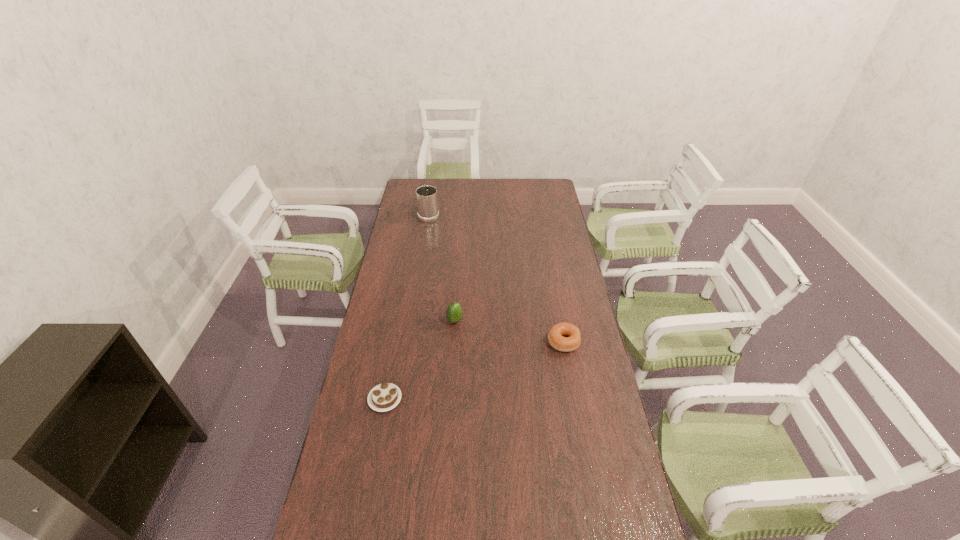
Where is `the farthest object`? The image size is (960, 540). the farthest object is located at coordinates (427, 202).

Image resolution: width=960 pixels, height=540 pixels. I want to click on mug, so click(x=427, y=202).

At what (x,y) coordinates should I click in order to perform the action: click on the second object from right to left. Please return your answer as a coordinate pair (x, y). Looking at the image, I should click on (454, 313).

Locate an element on the screen. This screenshot has width=960, height=540. the second farthest object is located at coordinates (454, 313).

Locate an element on the screen. Image resolution: width=960 pixels, height=540 pixels. the second nearest object is located at coordinates (566, 337).

This screenshot has height=540, width=960. I want to click on the second shortest object, so click(566, 337).

You are a GUI agent. You are given a task and a screenshot of the screen. Output one action in this format:
    pyautogui.click(x=<x>, y=<y>)
    Task: Click on the shortest object
    The height and width of the screenshot is (540, 960).
    Given the screenshot: What is the action you would take?
    coord(386,396)

You are a GUI agent. You are given a task and a screenshot of the screen. Output one action in this format:
    pyautogui.click(x=<x>, y=<y>)
    Task: Click on the nearest object
    The height and width of the screenshot is (540, 960).
    Given the screenshot: What is the action you would take?
    pyautogui.click(x=386, y=396)

Locate an element on the screen. The image size is (960, 540). free space located 0.070m on the side of the farthest object with the handle is located at coordinates (431, 200).

I want to click on blank space located on the side of the farthest object with the handle, so click(434, 183).